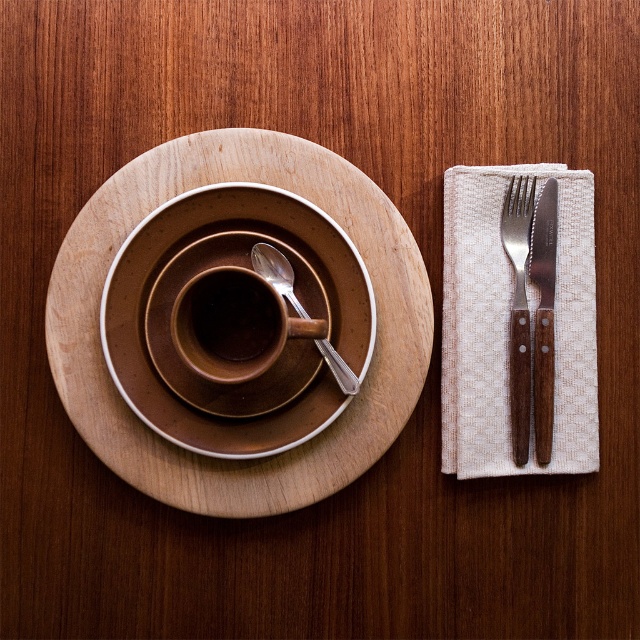
From the picture: You are a server in a restaurant and need to place a 22 inch long decorative ribbon from the edge of the table to the matte brown cup at center. Can the ribbon reach the cup from the table edge?

The distance between the matte brown cup at center and the viewer is 21.53 inches. Since the ribbon is 22 inches long, it can comfortably reach the cup from the table edge.

You are setting up a tea service and need to place the matte brown cup at center on top of the brown wooden knife at right. Is this possible based on their current positions?

The matte brown cup at center is positioned over the brown wooden knife at right, so yes, placing the matte brown cup at center on top of the brown wooden knife at right is possible as they are already aligned in that position.

You are setting up a tea service and need to place the matte brown cup at center and the matte silver spoon at center correctly. According to the image, which object is positioned to the left of the other?

The matte brown cup at center is to the left of the matte silver spoon at center.